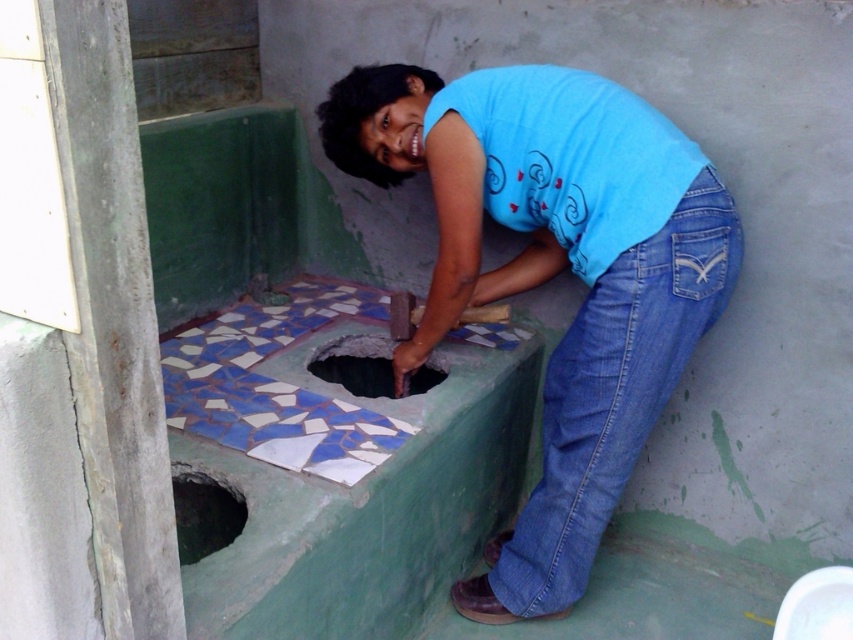
Question: Does denim at lower right appear on the left side of smooth concrete hole at center?

Choices:
 (A) yes
 (B) no

Answer: (B)

Question: Based on their relative distances, which object is farther from the smooth concrete hole at center?

Choices:
 (A) dark gray concrete hole at lower left
 (B) denim at lower right

Answer: (A)

Question: Which object is the closest to the denim at lower right?

Choices:
 (A) smooth concrete hole at center
 (B) blue cotton shirt at center
 (C) dark gray concrete hole at lower left

Answer: (B)

Question: Does blue cotton shirt at center have a greater width compared to dark gray concrete hole at lower left?

Choices:
 (A) no
 (B) yes

Answer: (B)

Question: Does dark gray concrete hole at lower left have a smaller size compared to smooth concrete hole at center?

Choices:
 (A) yes
 (B) no

Answer: (A)

Question: Which object is farther from the camera taking this photo?

Choices:
 (A) dark gray concrete hole at lower left
 (B) blue cotton shirt at center

Answer: (B)